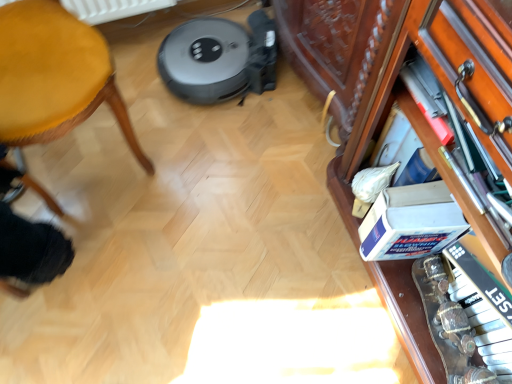
At what (x,y) coordinates should I click in order to perform the action: click on vacant region below yellow fabric stool at left (from a real-world perspective). Please return your answer as a coordinate pair (x, y). Image resolution: width=512 pixels, height=384 pixels. Looking at the image, I should click on (95, 160).